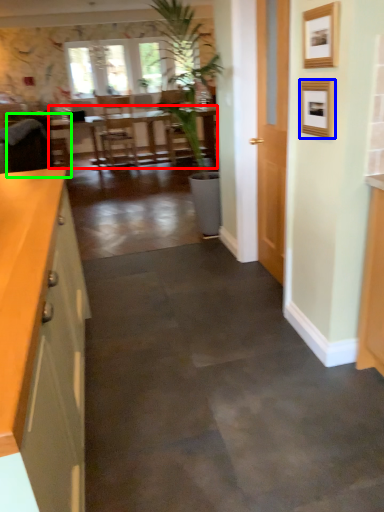
Question: Which is nearer to the table (highlighted by a red box)? picture frame (highlighted by a blue box) or armchair (highlighted by a green box).

Choices:
 (A) picture frame
 (B) armchair

Answer: (B)